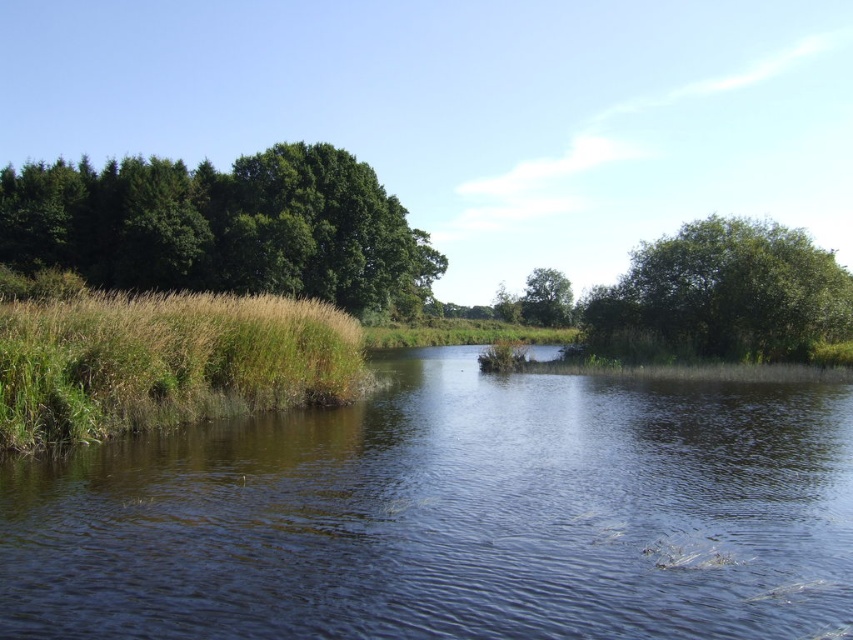
Is green grassy reed at left thinner than green leafy tree at right?

Yes, green grassy reed at left is thinner than green leafy tree at right.

Identify the location of green grassy reed at left. (165, 362).

Which is in front, point (111, 420) or point (746, 260)?

Point (111, 420) is more forward.

Locate an element on the screen. green grassy reed at left is located at coordinates (165, 362).

Is dark water at center thinner than green leafy trees at left?

Yes, dark water at center is thinner than green leafy trees at left.

Is dark water at center further to camera compared to green leafy trees at left?

No, it is in front of green leafy trees at left.

Find the location of a particular element. The width and height of the screenshot is (853, 640). dark water at center is located at coordinates (451, 515).

This screenshot has height=640, width=853. I want to click on dark water at center, so click(451, 515).

Which is above, green leafy trees at left or green leafy tree at center?

green leafy trees at left

Does green leafy trees at left have a greater width compared to green leafy tree at center?

Yes.

Image resolution: width=853 pixels, height=640 pixels. Find the location of `green leafy trees at left`. green leafy trees at left is located at coordinates (222, 227).